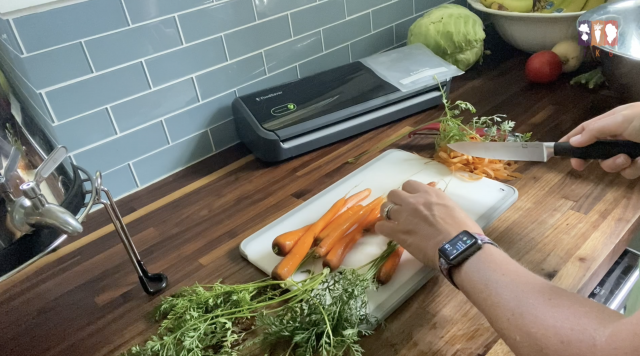
Where is `grey tile`? grey tile is located at coordinates (116, 85).